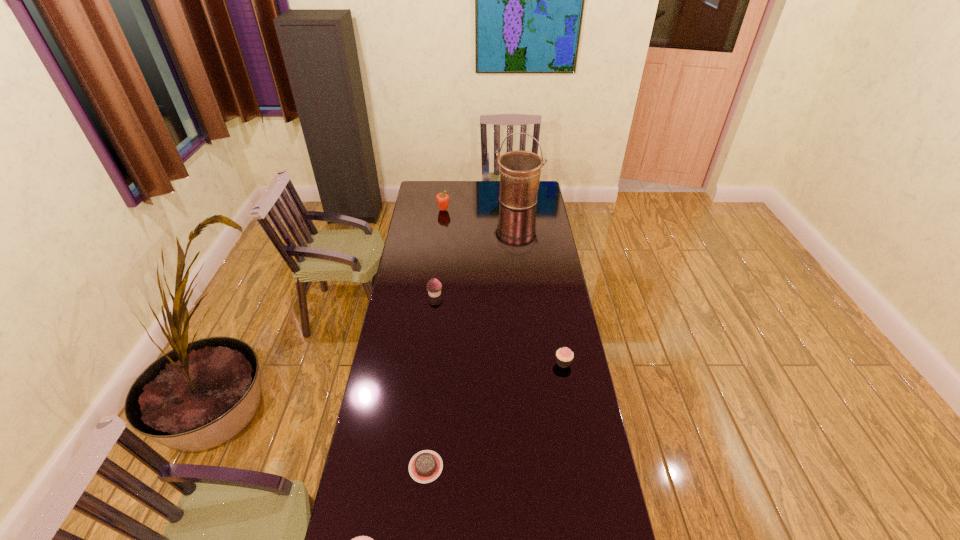
Locate an element on the screen. The width and height of the screenshot is (960, 540). bucket is located at coordinates (520, 171).

Where is `the fifth shortest object`? the fifth shortest object is located at coordinates (442, 199).

Where is `the second cupcake from right to left`? the second cupcake from right to left is located at coordinates (434, 287).

Locate an element on the screen. The width and height of the screenshot is (960, 540). the farthest cupcake is located at coordinates (434, 287).

The height and width of the screenshot is (540, 960). What are the coordinates of `the second farthest cupcake` in the screenshot? It's located at (564, 356).

At what (x,y) coordinates should I click in order to perform the action: click on the rightmost cupcake. Please return your answer as a coordinate pair (x, y). The width and height of the screenshot is (960, 540). Looking at the image, I should click on (564, 356).

At what (x,y) coordinates should I click in order to perform the action: click on the shortest object. Please return your answer as a coordinate pair (x, y). Image resolution: width=960 pixels, height=540 pixels. Looking at the image, I should click on (425, 466).

Find the location of a particular element. The height and width of the screenshot is (540, 960). the second nearest object is located at coordinates (425, 466).

Find the location of `vacant area situated on the back of the tallest object`. vacant area situated on the back of the tallest object is located at coordinates (516, 181).

Identify the location of vacant position located on the back of the fifth shortest object. (446, 181).